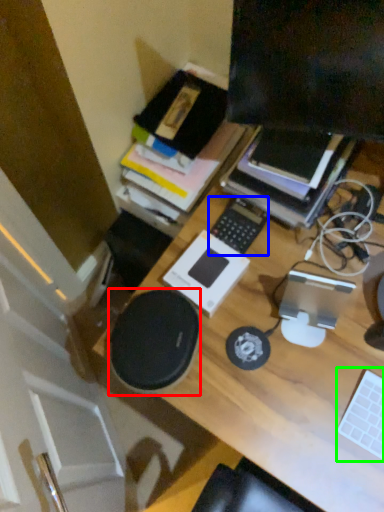
Question: Estimate the real-world distances between objects in this image. Which object is closer to speaker (highlighted by a red box), laptop keyboard (highlighted by a blue box) or laptop keyboard (highlighted by a green box)?

Choices:
 (A) laptop keyboard
 (B) laptop keyboard

Answer: (A)